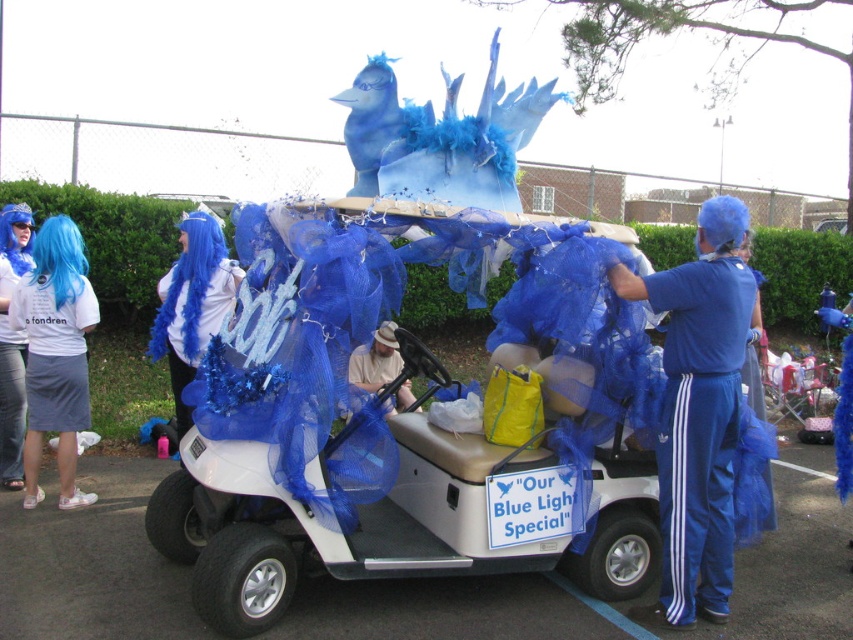
You are trying to determine if the white matte golf cart at center can fit through a doorway that is the same width as the beige fabric hat at center. Based on the information provided, can the golf cart pass through the doorway?

The white matte golf cart at center might be wider than beige fabric hat at center, so it is uncertain if it can pass through the doorway. Further measurements would be needed to confirm.

You are a photographer planning to take a photo of the white matte golf cart at center and the beige fabric hat at center. Since the golf cart is under the hat, where should you position your camera to capture both objects in the frame without any obstruction?

To capture both the white matte golf cart at center and the beige fabric hat at center without obstruction, position the camera above the beige fabric hat at center so that the golf cart underneath is visible. Since the white matte golf cart at center is positioned under the hat, an elevated angle would allow both objects to be seen clearly in the frame.

You are a delivery person standing next to the white matte golf cart at center. You need to place a beige fabric hat at center on the cart. Can you reach the hat from your current position without moving?

The white matte golf cart at center is 1.04 meters away from the beige fabric hat at center. Since the distance is over a meter, you cannot reach the hat without moving closer.